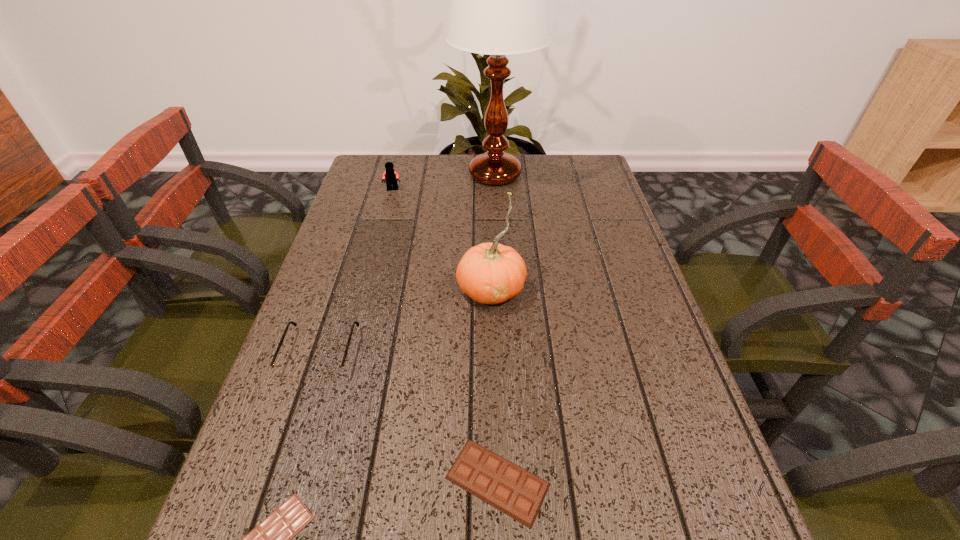
You are a GUI agent. You are given a task and a screenshot of the screen. Output one action in this format:
    pyautogui.click(x=<x>, y=<y>)
    Task: Click on the vacant space situated 0.180m on the front-facing side of the Lego
    The width and height of the screenshot is (960, 540).
    Given the screenshot: What is the action you would take?
    pyautogui.click(x=382, y=228)

Find the location of `vacant area located at the hinge ends of the fourth tallest object`. vacant area located at the hinge ends of the fourth tallest object is located at coordinates (295, 431).

This screenshot has width=960, height=540. Find the location of `free space located on the right of the right chocolate bar`. free space located on the right of the right chocolate bar is located at coordinates (686, 481).

Where is `table lamp that is at the far edge`? table lamp that is at the far edge is located at coordinates (499, 0).

Locate an element on the screen. Lego that is at the far edge is located at coordinates (390, 176).

Where is `Lego at the left edge`? This screenshot has width=960, height=540. Lego at the left edge is located at coordinates [x=390, y=176].

I want to click on spectacles present at the left edge, so click(286, 371).

I want to click on object situated at the far left corner, so pyautogui.click(x=390, y=176).

Locate an element on the screen. This screenshot has height=540, width=960. vacant area at the far edge is located at coordinates (414, 158).

Find the location of a particular element. The height and width of the screenshot is (540, 960). free region at the left edge of the desktop is located at coordinates (325, 349).